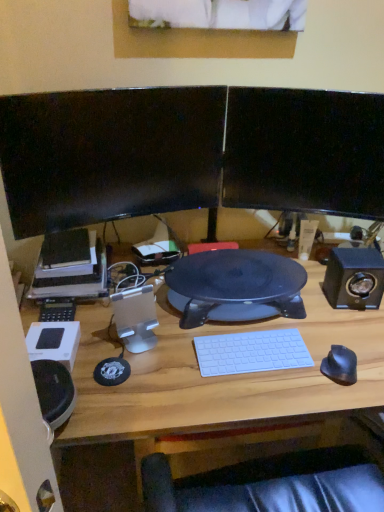
You are a GUI agent. You are given a task and a screenshot of the screen. Output one action in this format:
    pyautogui.click(x=<x>, y=<y>)
    Task: Click on the vacant area on top of white plastic keyboard at center (from a real-world perspective)
    
    Given the screenshot: What is the action you would take?
    pyautogui.click(x=250, y=348)